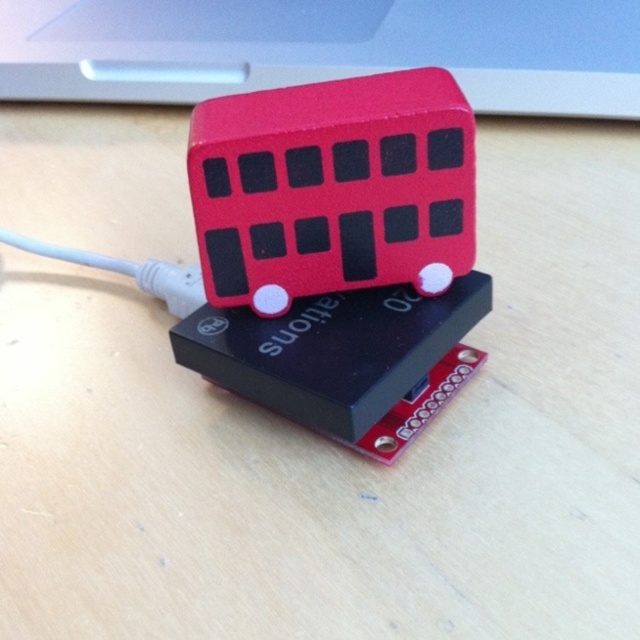
You are a delivery robot that needs to place a package on the matte red bus at upper center. The package is 2 feet wide. Can you safely place it without hitting the camera that is 5.35 feet away from the bus?

The matte red bus at upper center and camera are 5.35 feet apart. Since the package is only 2 feet wide, placing it on the bus would not interfere with the camera as the distance between them is sufficient.

You are an engineer inspecting a circuit board. You notice two buses on it. The first is a matte red bus at upper center, and the second is a rubber bus at center. Which bus is closer to you?

The matte red bus at upper center is closer to you because the rubber bus at center is positioned behind it.

You are an engineer inspecting a circuit board and notice two buses. The matte red bus at upper center and the rubber bus at center. Which one is placed above the other?

The matte red bus at upper center is positioned over the rubber bus at center.